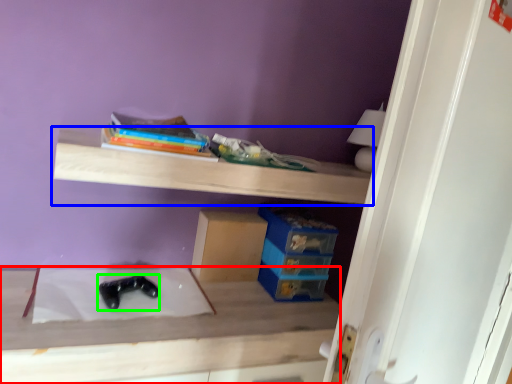
Question: Estimate the real-world distances between objects in this image. Which object is farther from table (highlighted by a red box), shelf (highlighted by a blue box) or shoe (highlighted by a green box)?

Choices:
 (A) shelf
 (B) shoe

Answer: (A)